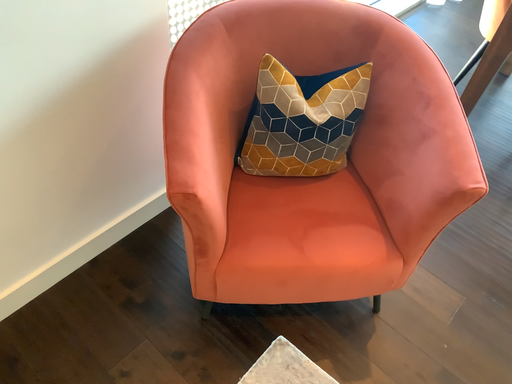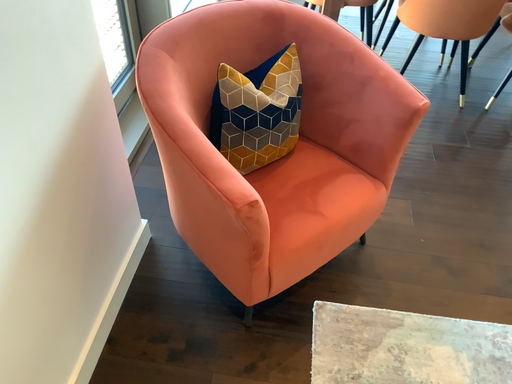
Question: Which way did the camera rotate in the video?

Choices:
 (A) rotated right
 (B) rotated left

Answer: (A)